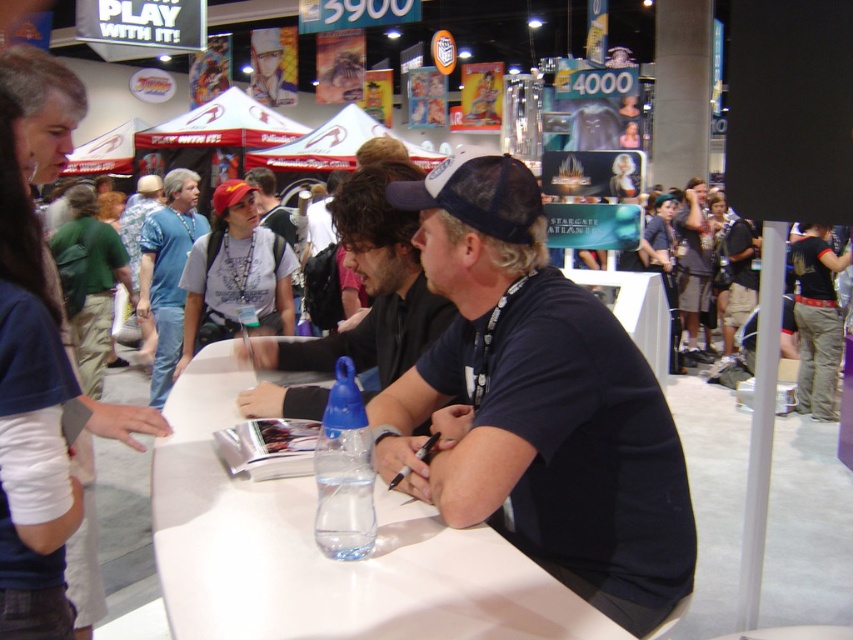
You are organizing a small signing event and need to place a name tag on the table. The name tag is 12 inches wide. Based on the scene, can the white glossy table at center accommodate the name tag without overlapping the black matte cap at center?

The white glossy table at center is wider than the black matte cap at center. Since the name tag is 12 inches wide, there should be enough space on the table to place it without overlapping the cap, provided the table has sufficient surface area beyond the cap.

You are a convention attendee holding a 30 cm wide poster you want to place on the white glossy table at center. Can the poster fit on the table without overlapping the edges?

The distance of white glossy table at center from viewer is 94.48 centimeters, but the table width is not provided. Therefore, it is impossible to determine if the poster will fit without additional information about the table dimensions.

You are an attendee at the convention and want to place a collectible item on the table. The collectible is 10 cm wide. Can you fit it on the white glossy table at center without it overlapping the black matte cap at center?

The white glossy table at center is to the left of the black matte cap at center, so placing the collectible 10 cm wide on the table would require ensuring it doesn not extend beyond the table or overlap the cap. However, without knowing the table dimensions, it is impossible to confirm if the space is sufficient. Please check the table size first.